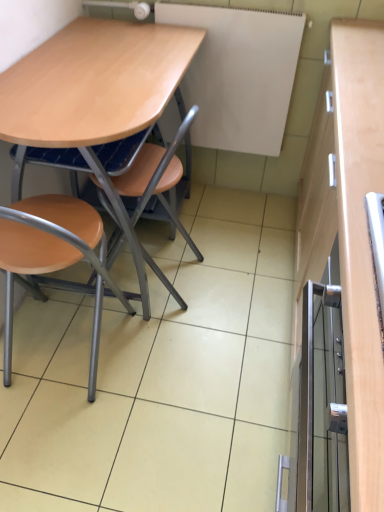
This screenshot has width=384, height=512. What do you see at coordinates (341, 289) in the screenshot?
I see `metallic silver cabinet at right` at bounding box center [341, 289].

Describe the element at coordinates (96, 95) in the screenshot. I see `light brown wood desk at center` at that location.

What is the approximate width of matte wood chair at lower left, marked as the first chair in a left-to-right arrangement?

matte wood chair at lower left, marked as the first chair in a left-to-right arrangement, is 17.38 inches wide.

The width and height of the screenshot is (384, 512). Find the location of `matte wood chair at center, which is counted as the first chair, starting from the right`. matte wood chair at center, which is counted as the first chair, starting from the right is located at coordinates (156, 177).

Describe the element at coordinates (156, 177) in the screenshot. The image size is (384, 512). I see `matte wood chair at center, which is counted as the first chair, starting from the right` at that location.

Locate an element on the screen. This screenshot has width=384, height=512. metallic silver cabinet at right is located at coordinates (341, 289).

Does matte wood chair at center, which is counted as the first chair, starting from the right, have a larger size compared to metallic silver cabinet at right?

Incorrect, matte wood chair at center, which is counted as the first chair, starting from the right, is not larger than metallic silver cabinet at right.

What's the angular difference between matte wood chair at center, which is counted as the first chair, starting from the right, and metallic silver cabinet at right's facing directions?

0.766 degrees separate the facing orientations of matte wood chair at center, which is counted as the first chair, starting from the right, and metallic silver cabinet at right.

From the picture: Relative to metallic silver cabinet at right, is matte wood chair at center, which is counted as the first chair, starting from the right, in front or behind?

In the image, matte wood chair at center, which is counted as the first chair, starting from the right, appears behind metallic silver cabinet at right.

From the image's perspective, between matte wood chair at center, which is counted as the first chair, starting from the right, and metallic silver cabinet at right, which one is located above?

From the image's view, matte wood chair at center, which is counted as the first chair, starting from the right, is above.

Considering the relative sizes of metallic silver cabinet at right and matte wood chair at lower left, marked as the first chair in a left-to-right arrangement, in the image provided, is metallic silver cabinet at right thinner than matte wood chair at lower left, marked as the first chair in a left-to-right arrangement,?

Correct, the width of metallic silver cabinet at right is less than that of matte wood chair at lower left, marked as the first chair in a left-to-right arrangement.

From the image's perspective, is metallic silver cabinet at right below matte wood chair at lower left, which ranks as the second chair in right-to-left order?

Yes, from the image's perspective, metallic silver cabinet at right is below matte wood chair at lower left, which ranks as the second chair in right-to-left order.

Does metallic silver cabinet at right appear on the left side of matte wood chair at lower left, marked as the first chair in a left-to-right arrangement?

Incorrect, metallic silver cabinet at right is not on the left side of matte wood chair at lower left, marked as the first chair in a left-to-right arrangement.

Is there a large distance between metallic silver cabinet at right and matte wood chair at lower left, which ranks as the second chair in right-to-left order?

They are positioned close to each other.

Is metallic silver cabinet at right inside or outside of white matte board at upper center?

metallic silver cabinet at right is not enclosed by white matte board at upper center.

Looking at this image, which of these two, metallic silver cabinet at right or white matte board at upper center, is wider?

With larger width is metallic silver cabinet at right.

Does metallic silver cabinet at right turn towards white matte board at upper center?

No, metallic silver cabinet at right is not turned towards white matte board at upper center.

From the image's perspective, which one is positioned higher, metallic silver cabinet at right or white matte board at upper center?

white matte board at upper center is shown above in the image.

Which object is positioned more to the right, light brown wood desk at center or metallic silver cabinet at right?

metallic silver cabinet at right is more to the right.

Does light brown wood desk at center touch metallic silver cabinet at right?

light brown wood desk at center is not next to metallic silver cabinet at right, and they're not touching.

Is light brown wood desk at center aimed at metallic silver cabinet at right?

No, light brown wood desk at center is not oriented towards metallic silver cabinet at right.

Could you measure the distance between matte wood chair at center, which appears as the 2th chair when viewed from the left, and white matte board at upper center?

The distance of matte wood chair at center, which appears as the 2th chair when viewed from the left, from white matte board at upper center is 20.84 inches.

From a real-world perspective, is matte wood chair at center, which is counted as the first chair, starting from the right, physically located above or below white matte board at upper center?

Clearly, from a real-world perspective, matte wood chair at center, which is counted as the first chair, starting from the right, is below white matte board at upper center.

Locate an element on the screen. The width and height of the screenshot is (384, 512). the 1st chair located beneath the white matte board at upper center (from a real-world perspective) is located at coordinates (156, 177).

Would you consider matte wood chair at center, which is counted as the first chair, starting from the right, to be distant from white matte board at upper center?

No, matte wood chair at center, which is counted as the first chair, starting from the right, is not far from white matte board at upper center.

In the scene shown: Considering the relative sizes of matte wood chair at lower left, which ranks as the second chair in right-to-left order, and light brown wood desk at center in the image provided, is matte wood chair at lower left, which ranks as the second chair in right-to-left order, shorter than light brown wood desk at center?

Yes.

Who is smaller, matte wood chair at lower left, marked as the first chair in a left-to-right arrangement, or light brown wood desk at center?

matte wood chair at lower left, marked as the first chair in a left-to-right arrangement, is smaller.

From a real-world perspective, starting from the light brown wood desk at center, which chair is the 2nd one below it? Please provide its 2D coordinates.

[(52, 257)]

Which object is closer to the camera, matte wood chair at center, which appears as the 2th chair when viewed from the left, or light brown wood desk at center?

light brown wood desk at center is closer to the camera.

Is matte wood chair at center, which appears as the 2th chair when viewed from the left, shorter than light brown wood desk at center?

Correct, matte wood chair at center, which appears as the 2th chair when viewed from the left, is not as tall as light brown wood desk at center.

Which chair is the 1st one when counting from the left side of the metallic silver cabinet at right? Please provide its 2D coordinates.

[(156, 177)]

The height and width of the screenshot is (512, 384). Identify the location of the 1st chair behind the metallic silver cabinet at right, starting your count from the anchor. (52, 257).

Considering their positions, is white matte board at upper center positioned closer to matte wood chair at lower left, marked as the first chair in a left-to-right arrangement, than matte wood chair at center, which is counted as the first chair, starting from the right?

Based on the image, matte wood chair at center, which is counted as the first chair, starting from the right, appears to be nearer to matte wood chair at lower left, marked as the first chair in a left-to-right arrangement.

Which object lies nearer to the anchor point matte wood chair at center, which appears as the 2th chair when viewed from the left, metallic silver cabinet at right or white matte board at upper center?

white matte board at upper center.

Based on their spatial positions, is matte wood chair at center, which is counted as the first chair, starting from the right, or matte wood chair at lower left, which ranks as the second chair in right-to-left order, closer to metallic silver cabinet at right?

matte wood chair at center, which is counted as the first chair, starting from the right, is closer to metallic silver cabinet at right.

In the scene shown: Considering their positions, is matte wood chair at center, which is counted as the first chair, starting from the right, positioned further to white matte board at upper center than matte wood chair at lower left, marked as the first chair in a left-to-right arrangement?

The object further to white matte board at upper center is matte wood chair at lower left, marked as the first chair in a left-to-right arrangement.

Looking at the image, which one is located closer to matte wood chair at lower left, which ranks as the second chair in right-to-left order, matte wood chair at center, which appears as the 2th chair when viewed from the left, or light brown wood desk at center?

The object closer to matte wood chair at lower left, which ranks as the second chair in right-to-left order, is matte wood chair at center, which appears as the 2th chair when viewed from the left.

Estimate the real-world distances between objects in this image. Which object is further from metallic silver cabinet at right, matte wood chair at center, which is counted as the first chair, starting from the right, or white matte board at upper center?

Based on the image, matte wood chair at center, which is counted as the first chair, starting from the right, appears to be further to metallic silver cabinet at right.

When comparing their distances from matte wood chair at lower left, which ranks as the second chair in right-to-left order, does light brown wood desk at center or white matte board at upper center seem further?

white matte board at upper center.

Looking at the image, which one is located closer to light brown wood desk at center, matte wood chair at lower left, marked as the first chair in a left-to-right arrangement, or white matte board at upper center?

matte wood chair at lower left, marked as the first chair in a left-to-right arrangement, is positioned closer to the anchor light brown wood desk at center.

You are a GUI agent. You are given a task and a screenshot of the screen. Output one action in this format:
    pyautogui.click(x=<x>, y=<y>)
    Task: Click on the chair between light brown wood desk at center and matte wood chair at lower left, marked as the first chair in a left-to-right arrangement, in the up-down direction
    The height and width of the screenshot is (512, 384).
    Given the screenshot: What is the action you would take?
    pyautogui.click(x=156, y=177)

You are a GUI agent. You are given a task and a screenshot of the screen. Output one action in this format:
    pyautogui.click(x=<x>, y=<y>)
    Task: Click on the chair between matte wood chair at lower left, marked as the first chair in a left-to-right arrangement, and metallic silver cabinet at right
    The width and height of the screenshot is (384, 512).
    Given the screenshot: What is the action you would take?
    pyautogui.click(x=156, y=177)

Locate an element on the screen. desk between matte wood chair at lower left, which ranks as the second chair in right-to-left order, and metallic silver cabinet at right, in the horizontal direction is located at coordinates (96, 95).

The image size is (384, 512). I want to click on chair between light brown wood desk at center and white matte board at upper center in the front-back direction, so click(156, 177).